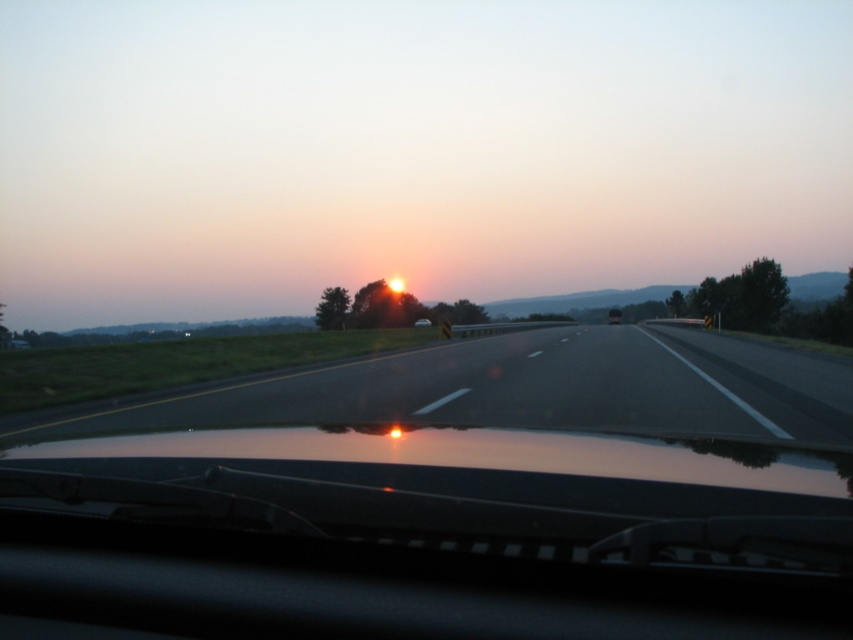
You are a driver in a car that is exactly 15 feet long. You see the black asphalt highway at center and the matte black car at center. Can your car fit entirely between them without overlapping either?

The distance between the black asphalt highway at center and the matte black car at center is 226.35 feet. Since your car is only 15 feet long, there is more than enough space for it to fit entirely between them without overlapping either.

You are a driver in the matte black car at center. You want to know if your car is longer than the black asphalt highway at center. Can you confirm?

The black asphalt highway at center is shorter than matte black car at center, so yes, the matte black car at center is longer than the black asphalt highway at center.

You are driving a matte black car at center and need to stay within the black asphalt highway at center. According to the scene, is the highway positioned to the left or right of your car?

The black asphalt highway at center is positioned on the left side of the matte black car at center, so the highway is to the left of the car.